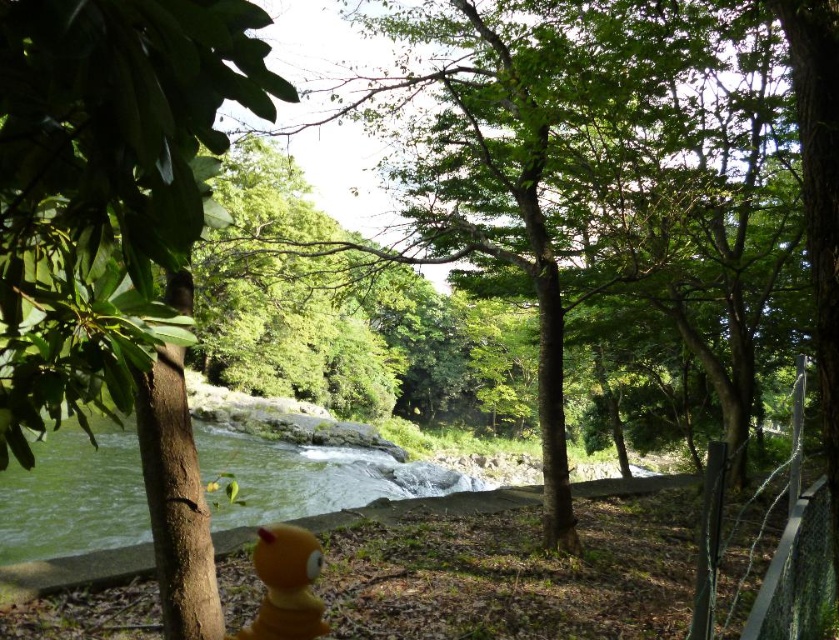
Which of these two, black wire mesh at right or yellow rubber duck at lower center, stands shorter?

yellow rubber duck at lower center

Can you confirm if black wire mesh at right is positioned below yellow rubber duck at lower center?

Indeed, black wire mesh at right is positioned under yellow rubber duck at lower center.

Where is `black wire mesh at right`? The height and width of the screenshot is (640, 839). black wire mesh at right is located at coordinates (796, 548).

Can you confirm if green liquid water at center is positioned above black wire mesh at right?

Actually, green liquid water at center is below black wire mesh at right.

Describe the element at coordinates (74, 496) in the screenshot. I see `green liquid water at center` at that location.

You are a GUI agent. You are given a task and a screenshot of the screen. Output one action in this format:
    pyautogui.click(x=<x>, y=<y>)
    Task: Click on the green liquid water at center
    Image resolution: width=839 pixels, height=640 pixels.
    Given the screenshot: What is the action you would take?
    pyautogui.click(x=74, y=496)

Who is more forward, (336, 506) or (318, 612)?

Positioned in front is point (318, 612).

In the scene shown: Does green liquid water at center lie behind yellow rubber duck at lower center?

Yes, it is behind yellow rubber duck at lower center.

The image size is (839, 640). Identify the location of green liquid water at center. (74, 496).